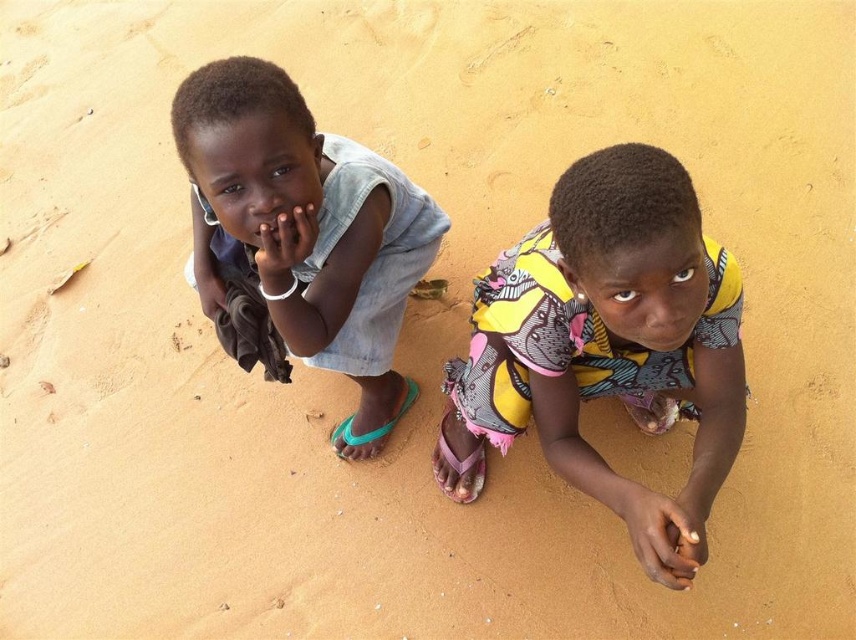
Does printed fabric dress at center have a lesser width compared to light blue denim shorts at left?

No, printed fabric dress at center is not thinner than light blue denim shorts at left.

Describe the element at coordinates (607, 346) in the screenshot. I see `printed fabric dress at center` at that location.

Find the location of `printed fabric dress at center`. printed fabric dress at center is located at coordinates (607, 346).